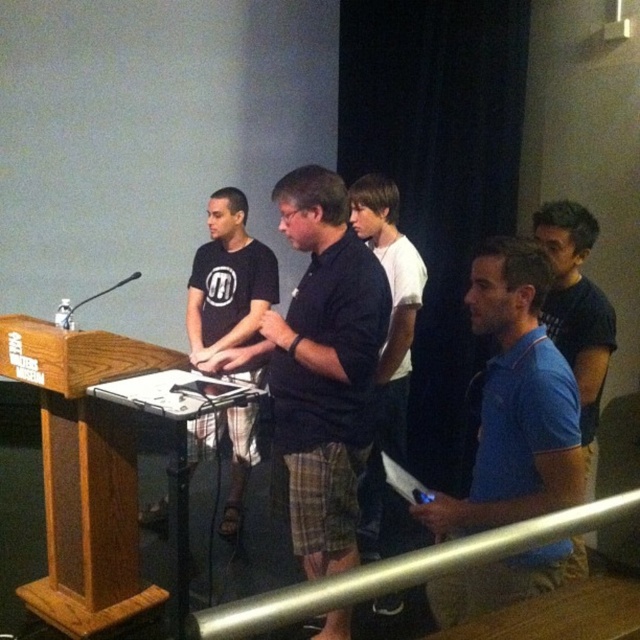
Does black cotton shirt at center have a greater height compared to blue cotton polo shirt at center?

Yes, black cotton shirt at center is taller than blue cotton polo shirt at center.

Which is in front, point (280, 381) or point (548, 582)?

Point (548, 582) is in front.

Locate an element on the screen. This screenshot has height=640, width=640. black cotton shirt at center is located at coordinates 324,368.

From the picture: Does black cotton shirt at center appear under metallic silver rail at lower center?

Indeed, black cotton shirt at center is positioned under metallic silver rail at lower center.

Measure the distance between point (333, 326) and camera.

2.14 meters

Locate an element on the screen. This screenshot has width=640, height=640. black cotton shirt at center is located at coordinates (324, 368).

The width and height of the screenshot is (640, 640). I want to click on black cotton shirt at center, so click(324, 368).

Does white cotton shirt at center appear under metallic silver rail at lower center?

Yes, white cotton shirt at center is below metallic silver rail at lower center.

Does white cotton shirt at center appear on the right side of metallic silver rail at lower center?

Correct, you'll find white cotton shirt at center to the right of metallic silver rail at lower center.

The height and width of the screenshot is (640, 640). Describe the element at coordinates (387, 342) in the screenshot. I see `white cotton shirt at center` at that location.

At what (x,y) coordinates should I click in order to perform the action: click on white cotton shirt at center. Please return your answer as a coordinate pair (x, y). The width and height of the screenshot is (640, 640). Looking at the image, I should click on (387, 342).